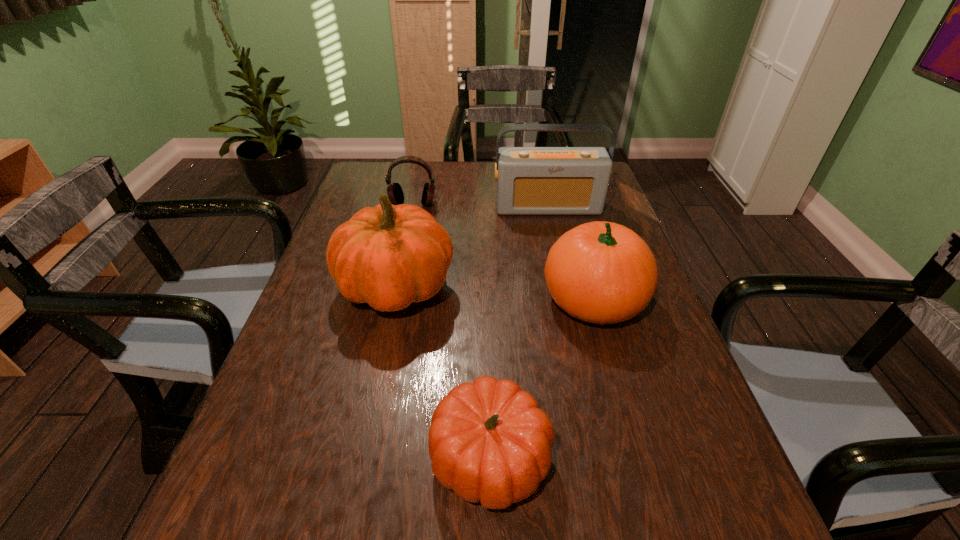
The image size is (960, 540). I want to click on vacant region located on the ear pads of the headset, so click(406, 238).

At what (x,y) coordinates should I click in order to perform the action: click on free region located 0.100m on the back of the nearest object. Please return your answer as a coordinate pair (x, y). Image resolution: width=960 pixels, height=540 pixels. Looking at the image, I should click on (490, 362).

Find the location of a particular element. pumpkin located at the left edge is located at coordinates [x=389, y=256].

In order to click on headset that is at the left edge in this screenshot , I will do `click(395, 193)`.

I want to click on radio receiver present at the right edge, so click(530, 180).

The height and width of the screenshot is (540, 960). In order to click on pumpkin at the right edge in this screenshot , I will do `click(601, 272)`.

Find the location of a particular element. This screenshot has height=540, width=960. vacant space at the far edge of the desktop is located at coordinates (471, 192).

Where is `free region at the near edge`? Image resolution: width=960 pixels, height=540 pixels. free region at the near edge is located at coordinates (423, 539).

The width and height of the screenshot is (960, 540). Identify the location of vacant region at the left edge. (378, 199).

Locate an element on the screen. Image resolution: width=960 pixels, height=540 pixels. blank space at the right edge of the desktop is located at coordinates (608, 206).